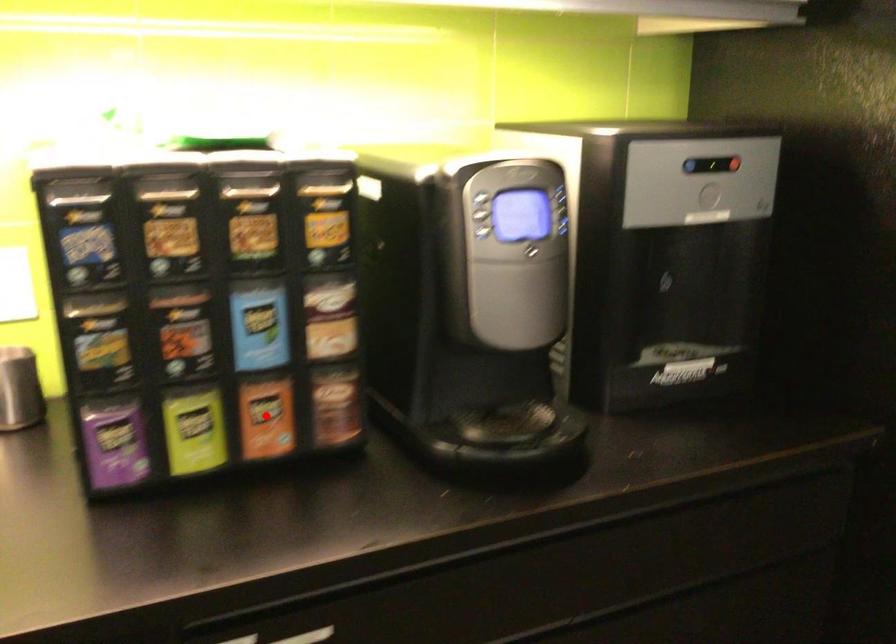
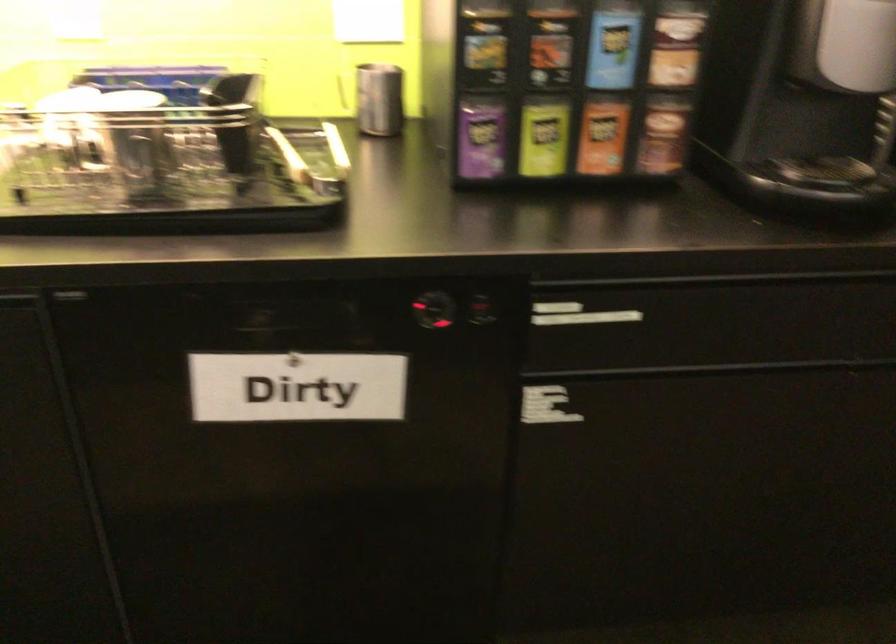
In the second image, find the point that corresponds to the highlighted location in the first image.

(602, 136)